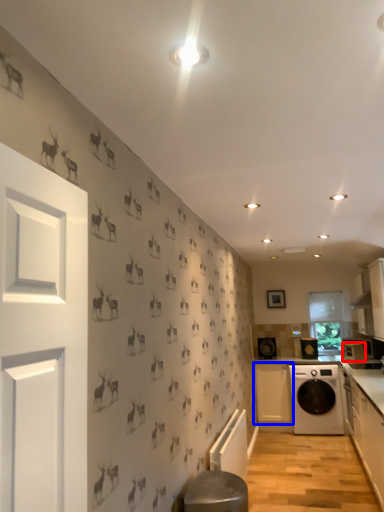
Question: Which object is closer to the camera taking this photo, appliance (highlighted by a red box) or cabinetry (highlighted by a blue box)?

Choices:
 (A) appliance
 (B) cabinetry

Answer: (A)